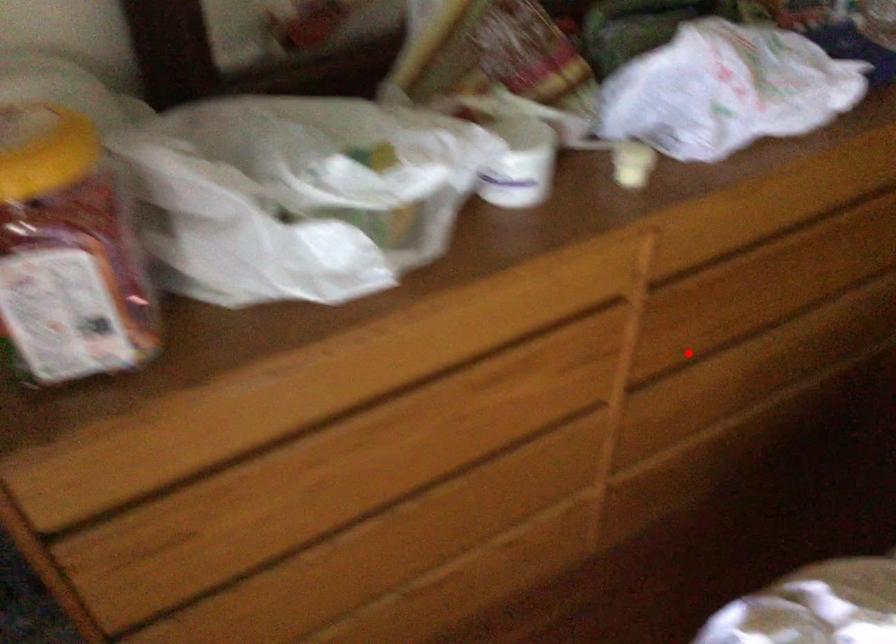
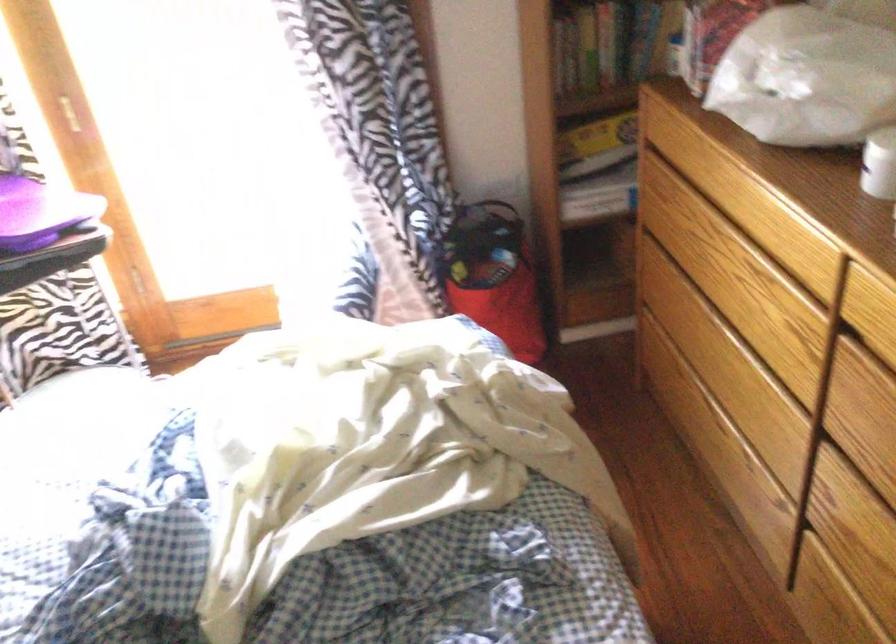
Where in the second image is the point corresponding to the highlighted location from the first image?

(868, 460)